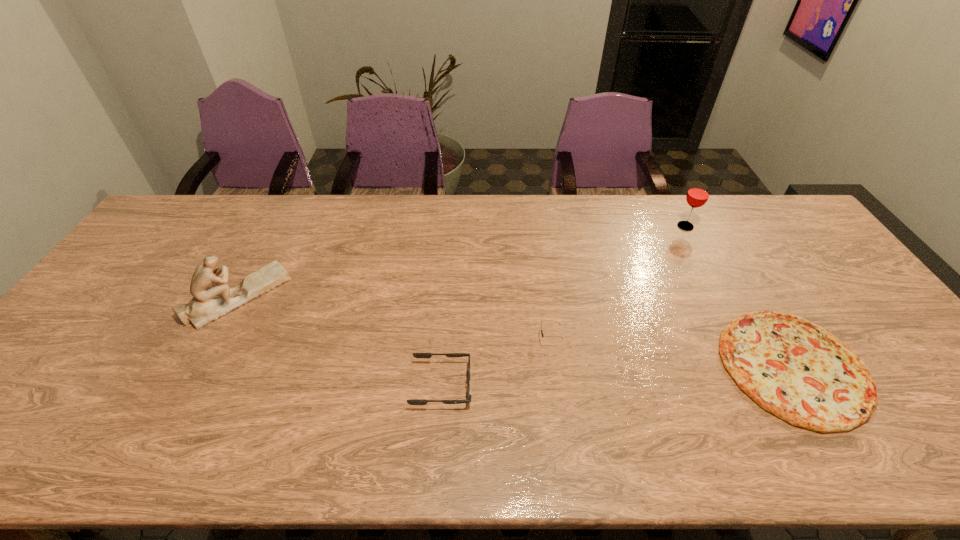
Where is `blank space located in front of the lenses of the right sunglasses`? The image size is (960, 540). blank space located in front of the lenses of the right sunglasses is located at coordinates (443, 340).

This screenshot has width=960, height=540. What are the coordinates of `vacant space situated 0.290m in front of the lenses of the right sunglasses` in the screenshot? It's located at (427, 340).

Image resolution: width=960 pixels, height=540 pixels. I want to click on vacant space located 0.210m on the temples of the fourth object from right to left, so click(x=560, y=385).

Identify the location of free space located 0.330m on the back of the pizza. (716, 237).

You are a GUI agent. You are given a task and a screenshot of the screen. Output one action in this format:
    pyautogui.click(x=<x>, y=<y>)
    Task: Click on the object that is positioned at the far edge
    This screenshot has height=540, width=960.
    Given the screenshot: What is the action you would take?
    pyautogui.click(x=698, y=194)

Locate an element on the screen. Image resolution: width=960 pixels, height=540 pixels. object positioned at the near edge is located at coordinates click(x=797, y=370).

I want to click on object that is at the right edge, so click(x=797, y=370).

Locate an element on the screen. object located at the near right corner is located at coordinates (797, 370).

Locate an element on the screen. The width and height of the screenshot is (960, 540). blank area at the far edge is located at coordinates (735, 205).

Where is `vacant space at the near edge of the desktop`? The image size is (960, 540). vacant space at the near edge of the desktop is located at coordinates (206, 446).